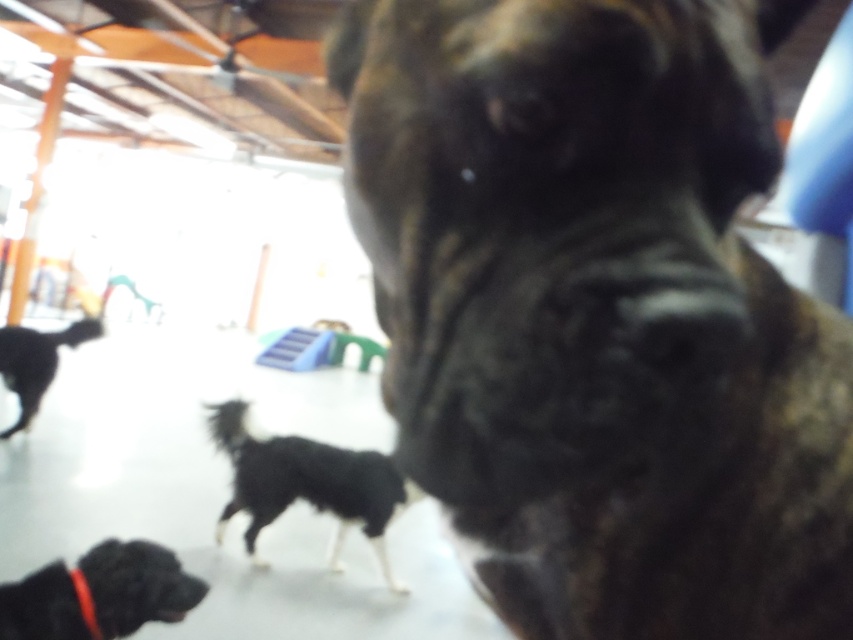
Does black fur dog at center appear over red fabric neckband at lower left?

No.

Is point (248, 458) positioned behind point (73, 579)?

Yes.

You are a GUI agent. You are given a task and a screenshot of the screen. Output one action in this format:
    pyautogui.click(x=<x>, y=<y>)
    Task: Click on the black fur dog at center
    
    Given the screenshot: What is the action you would take?
    pyautogui.click(x=306, y=483)

In the scene shown: Does black fur dog at left come in front of red fabric neckband at lower left?

No.

Locate an element on the screen. black fur dog at left is located at coordinates (36, 362).

Between brown brindle dog at center and red fabric neckband at lower left, which one has more height?

A: brown brindle dog at center

What do you see at coordinates (599, 312) in the screenshot? The height and width of the screenshot is (640, 853). I see `brown brindle dog at center` at bounding box center [599, 312].

Find the location of a particular element. The image size is (853, 640). brown brindle dog at center is located at coordinates (599, 312).